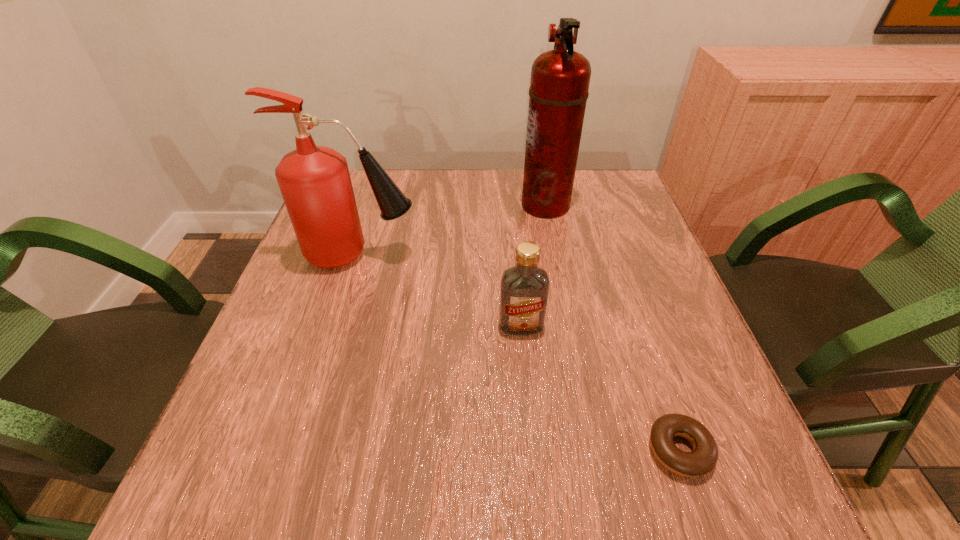
Identify the location of vacant space that's between the nearest object and the third shortest object. The image size is (960, 540). (519, 353).

Point out which object is positioned as the third nearest to the tallest object. Please provide its 2D coordinates. Your answer should be formatted as a tuple, i.e. [(x, y)], where the tuple contains the x and y coordinates of a point satisfying the conditions above.

[(703, 458)]

Image resolution: width=960 pixels, height=540 pixels. Identify the location of object that stands as the third closest to the second tallest object. (703, 458).

I want to click on free point that satisfies the following two spatial constraints: 1. with the nozzle aimed from the doughnut; 2. on the right side of the leftmost object, so click(x=300, y=450).

Identify the location of vacant region that satisfies the following two spatial constraints: 1. on the nozzle side of the nearest object; 2. on the right side of the right fire extinguisher. (592, 450).

At what (x,y) coordinates should I click in order to perform the action: click on vacant space that satisfies the following two spatial constraints: 1. on the front-facing side of the second shortest object; 2. on the left side of the doughnut. Please return your answer as a coordinate pair (x, y). The image size is (960, 540). Looking at the image, I should click on (533, 450).

Identify the location of free space that satisfies the following two spatial constraints: 1. with the nozzle aimed from the shorter fire extinguisher; 2. on the left side of the doughnut. (300, 450).

At what (x,y) coordinates should I click in order to perform the action: click on vacant space that satisfies the following two spatial constraints: 1. with the nozzle aimed from the third nearest object; 2. on the back side of the doughnut. Please return your answer as a coordinate pair (x, y). Looking at the image, I should click on pos(300,450).

You are a GUI agent. You are given a task and a screenshot of the screen. Output one action in this format:
    pyautogui.click(x=<x>, y=<y>)
    Task: Click on the vacant area that satisfies the following two spatial constraints: 1. with the nozzle aimed from the third nearest object; 2. on the back side of the shortest object
    
    Given the screenshot: What is the action you would take?
    pyautogui.click(x=300, y=450)

Locate an element on the screen. vacant position in the image that satisfies the following two spatial constraints: 1. on the nozzle side of the right fire extinguisher; 2. on the right side of the shortest object is located at coordinates (592, 450).